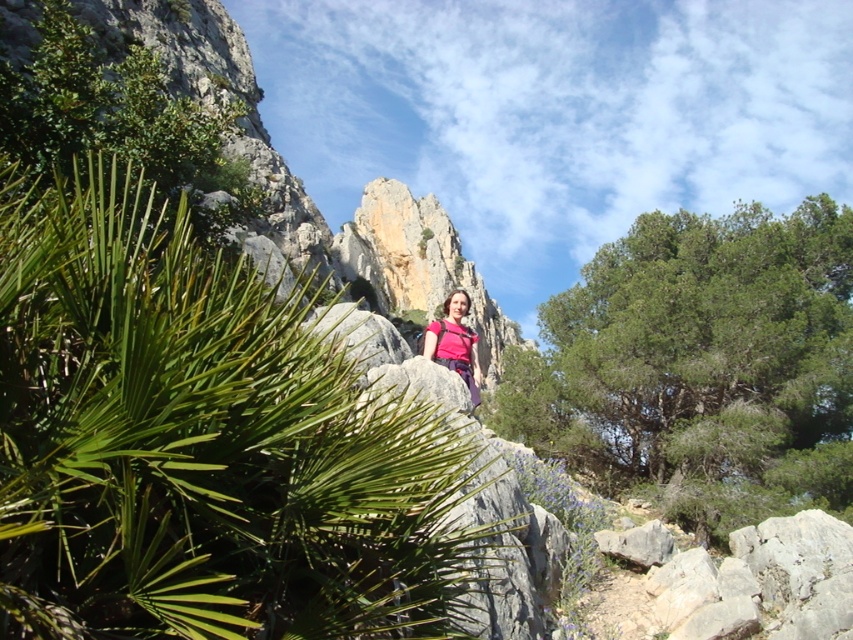
Question: Is green leafy tree at center positioned in front of pink fabric at center?

Choices:
 (A) no
 (B) yes

Answer: (A)

Question: Which of the following is the closest to the observer?

Choices:
 (A) green leafy plant at center
 (B) green leafy tree at center

Answer: (A)

Question: Does green leafy tree at center lie behind pink fabric at center?

Choices:
 (A) no
 (B) yes

Answer: (B)

Question: Which object appears farthest from the camera in this image?

Choices:
 (A) green leafy plant at center
 (B) pink fabric at center

Answer: (B)

Question: Is green leafy plant at center positioned before pink fabric at center?

Choices:
 (A) yes
 (B) no

Answer: (A)

Question: Among these objects, which one is nearest to the camera?

Choices:
 (A) pink fabric at center
 (B) green leafy tree at center

Answer: (A)